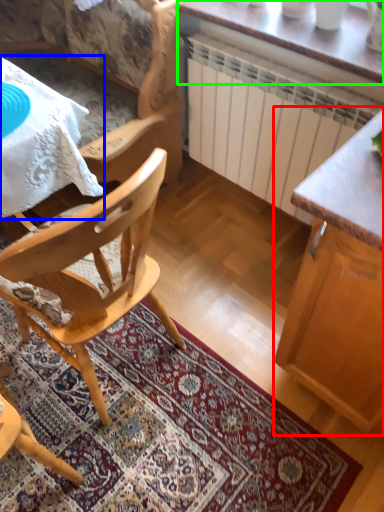
Question: Which object is the closest to the cabinetry (highlighted by a red box)? Choose among these: desk (highlighted by a blue box) or table (highlighted by a green box).

Choices:
 (A) desk
 (B) table

Answer: (B)